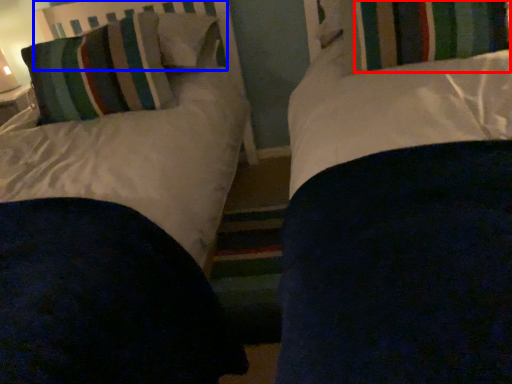
Question: Which point is closer to the camera, curtain (highlighted by a red box) or headboard (highlighted by a blue box)?

Choices:
 (A) curtain
 (B) headboard

Answer: (A)